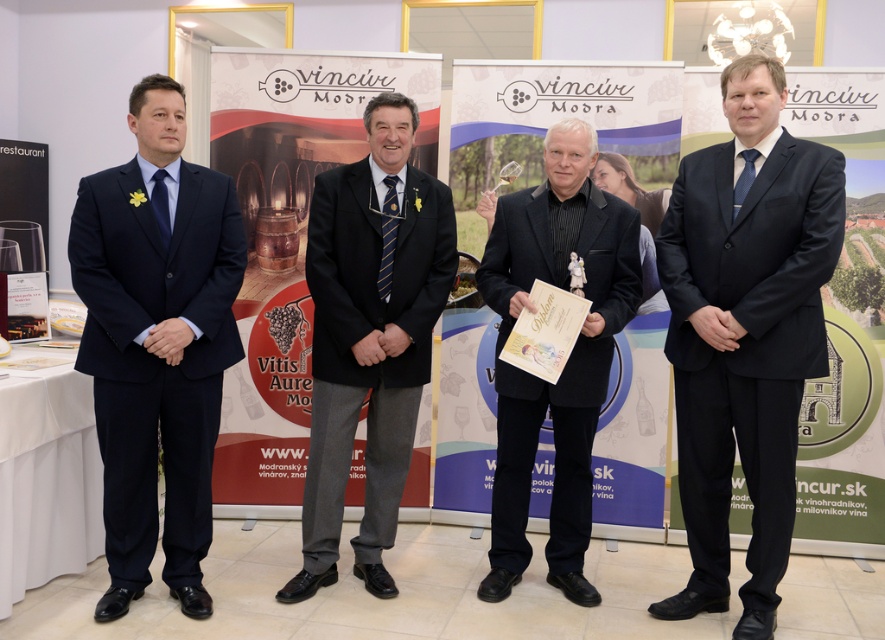
Question: Can you confirm if matte black suit at center is positioned to the left of matte black tie at left?

Choices:
 (A) no
 (B) yes

Answer: (A)

Question: Among these objects, which one is nearest to the camera?

Choices:
 (A) matte black suit at center
 (B) black satin suit at center
 (C) navy blue suit at left
 (D) matte black signboard at center

Answer: (A)

Question: Which object is closer to the camera taking this photo?

Choices:
 (A) black wool suit at center
 (B) blue silk tie at right
 (C) navy blue suit at left

Answer: (C)

Question: Which object appears farthest from the camera in this image?

Choices:
 (A) blue silk tie at right
 (B) blue striped tie at center
 (C) black satin suit at center

Answer: (B)

Question: Is the position of black satin suit at center more distant than that of blue silk tie at right?

Choices:
 (A) no
 (B) yes

Answer: (B)

Question: Considering the relative positions of matte black signboard at center and black satin suit at center in the image provided, where is matte black signboard at center located with respect to black satin suit at center?

Choices:
 (A) below
 (B) above

Answer: (B)